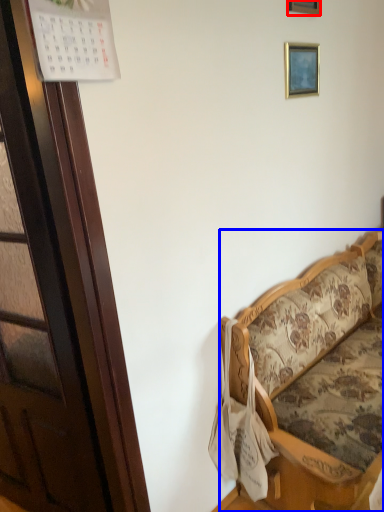
Question: Which object appears farthest to the camera in this image, picture frame (highlighted by a red box) or studio couch (highlighted by a blue box)?

Choices:
 (A) picture frame
 (B) studio couch

Answer: (A)